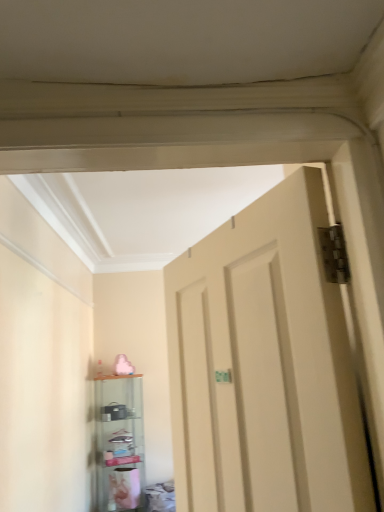
Question: Is matte beige door at center in front of or behind transparent glass shelf at lower left in the image?

Choices:
 (A) behind
 (B) front

Answer: (B)

Question: Would you say matte beige door at center is inside or outside transparent glass shelf at lower left?

Choices:
 (A) inside
 (B) outside

Answer: (B)

Question: In terms of width, does matte beige door at center look wider or thinner when compared to transparent glass shelf at lower left?

Choices:
 (A) wide
 (B) thin

Answer: (B)

Question: Is transparent glass shelf at lower left inside or outside of matte beige door at center?

Choices:
 (A) inside
 (B) outside

Answer: (B)

Question: Does point (140, 437) appear closer or farther from the camera than point (292, 391)?

Choices:
 (A) farther
 (B) closer

Answer: (A)

Question: Is transparent glass shelf at lower left in front of or behind matte beige door at center in the image?

Choices:
 (A) behind
 (B) front

Answer: (A)

Question: From a real-world perspective, relative to matte beige door at center, is transparent glass shelf at lower left vertically above or below?

Choices:
 (A) above
 (B) below

Answer: (B)